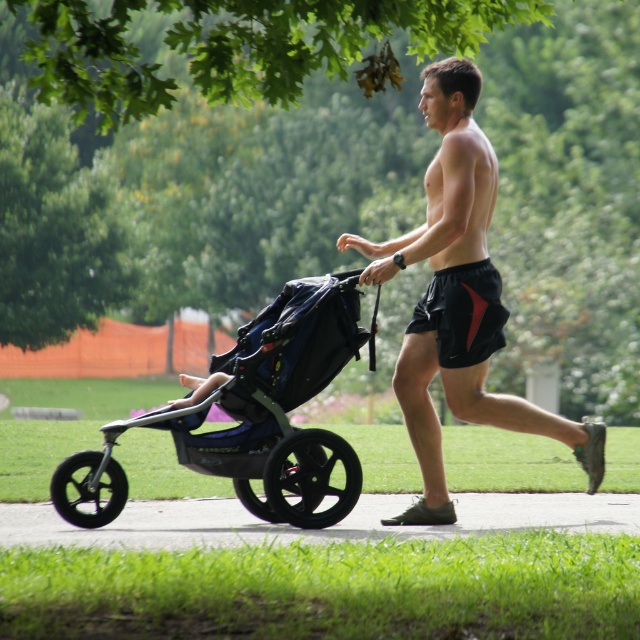
Question: Does black matte shorts at center have a larger size compared to black matte stroller at left?

Choices:
 (A) yes
 (B) no

Answer: (A)

Question: Is black rubber pavement at lower center closer to the viewer compared to black mesh shorts at center?

Choices:
 (A) yes
 (B) no

Answer: (A)

Question: In this image, where is black matte shorts at center located relative to black matte stroller at left?

Choices:
 (A) left
 (B) right

Answer: (B)

Question: Among these points, which one is nearest to the camera?

Choices:
 (A) (45, 516)
 (B) (344, 355)

Answer: (B)

Question: Based on their relative distances, which object is farther from the black mesh shorts at center?

Choices:
 (A) black matte shorts at center
 (B) black matte stroller at left
 (C) black rubber pavement at lower center

Answer: (C)

Question: Which point is farther to the camera?

Choices:
 (A) (326, 380)
 (B) (220, 524)

Answer: (B)